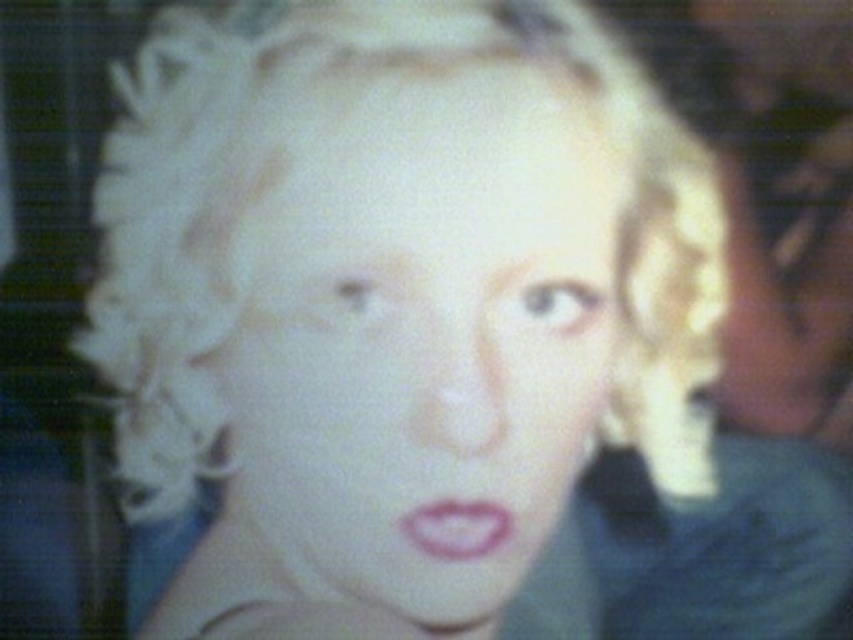
Question: Does smooth skin face at center appear on the left side of pink matte lips at center?

Choices:
 (A) yes
 (B) no

Answer: (A)

Question: Which of the following is the farthest from the observer?

Choices:
 (A) pink matte lips at center
 (B) smooth skin face at center

Answer: (A)

Question: Which of the following is the farthest from the observer?

Choices:
 (A) pink matte lips at center
 (B) smooth skin face at center

Answer: (A)

Question: Which point is farther to the camera?

Choices:
 (A) smooth skin face at center
 (B) pink matte lips at center

Answer: (B)

Question: Does smooth skin face at center appear on the right side of pink matte lips at center?

Choices:
 (A) no
 (B) yes

Answer: (A)

Question: Does smooth skin face at center lie in front of pink matte lips at center?

Choices:
 (A) no
 (B) yes

Answer: (B)